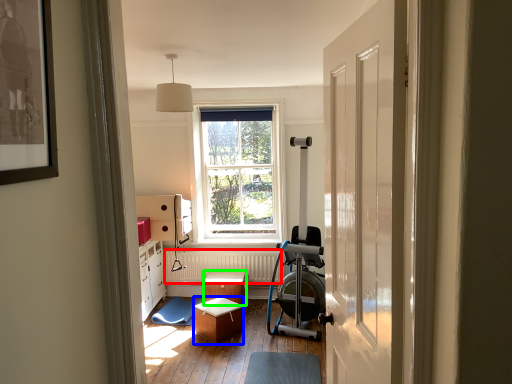
Question: Which object is the farthest from radiator (highlighted by a red box)? Choose among these: stool (highlighted by a blue box) or stool (highlighted by a green box).

Choices:
 (A) stool
 (B) stool

Answer: (A)